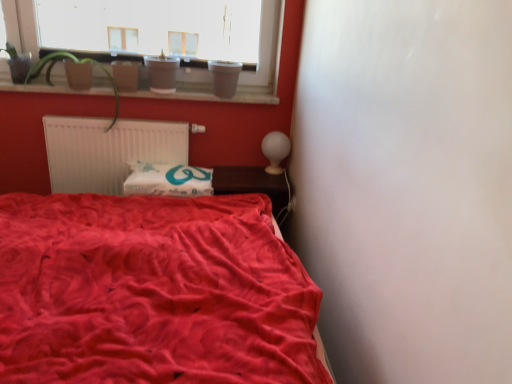
Question: Considering the positions of point (230, 357) and point (5, 69), is point (230, 357) closer or farther from the camera than point (5, 69)?

Choices:
 (A) farther
 (B) closer

Answer: (B)

Question: In terms of width, does velvet red bed at lower left look wider or thinner when compared to white plastic window at upper left?

Choices:
 (A) wide
 (B) thin

Answer: (A)

Question: Which of these objects is positioned closest to the white paper at center?

Choices:
 (A) white plastic window at upper left
 (B) white matte radiator at upper left
 (C) smooth wooden window sill at upper center
 (D) green matte plant at upper left
 (E) velvet red bed at lower left

Answer: (B)

Question: Which of these objects is positioned closest to the white matte radiator at upper left?

Choices:
 (A) brown wooden table at center
 (B) white paper at center
 (C) white plastic window at upper left
 (D) smooth wooden window sill at upper center
 (E) velvet red bed at lower left

Answer: (B)